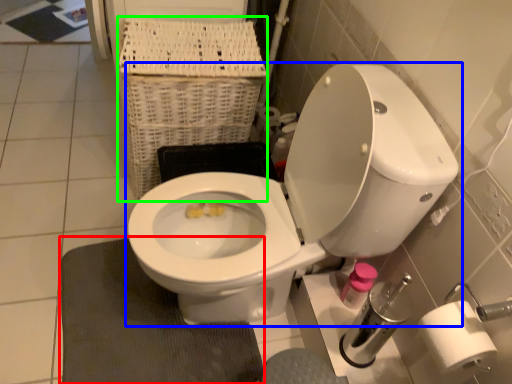
Question: Considering the real-world distances, which object is farthest from bath mat (highlighted by a red box)? toilet (highlighted by a blue box) or basket (highlighted by a green box)?

Choices:
 (A) toilet
 (B) basket

Answer: (B)